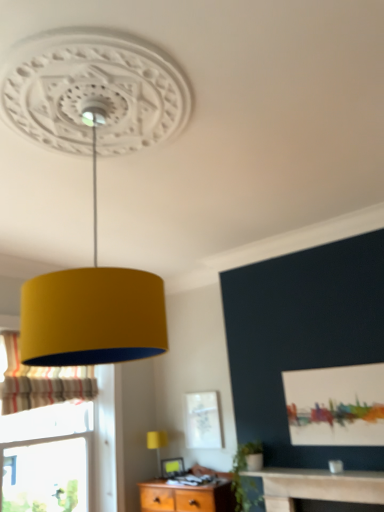
Question: From the image's perspective, would you say matte white picture frame at lower center is shown under striped fabric curtain at left?

Choices:
 (A) yes
 (B) no

Answer: (A)

Question: Can you confirm if matte white picture frame at lower center is smaller than striped fabric curtain at left?

Choices:
 (A) yes
 (B) no

Answer: (A)

Question: Is matte white picture frame at lower center not within striped fabric curtain at left?

Choices:
 (A) no
 (B) yes

Answer: (B)

Question: Is matte white picture frame at lower center at the left side of striped fabric curtain at left?

Choices:
 (A) no
 (B) yes

Answer: (A)

Question: From the image's perspective, is matte white picture frame at lower center on striped fabric curtain at left?

Choices:
 (A) no
 (B) yes

Answer: (A)

Question: Considering the relative sizes of matte white picture frame at lower center and striped fabric curtain at left in the image provided, is matte white picture frame at lower center shorter than striped fabric curtain at left?

Choices:
 (A) no
 (B) yes

Answer: (B)

Question: Is matte white picture frame at lower center at the right side of matte yellow lampshade at lower center?

Choices:
 (A) yes
 (B) no

Answer: (A)

Question: From the image's perspective, does matte white picture frame at lower center appear higher than matte yellow lampshade at lower center?

Choices:
 (A) yes
 (B) no

Answer: (B)

Question: Is matte white picture frame at lower center shorter than matte yellow lampshade at lower center?

Choices:
 (A) no
 (B) yes

Answer: (B)

Question: From a real-world perspective, is matte white picture frame at lower center beneath matte yellow lampshade at lower center?

Choices:
 (A) yes
 (B) no

Answer: (A)

Question: From the image's perspective, would you say matte white picture frame at lower center is shown under matte yellow lampshade at lower center?

Choices:
 (A) no
 (B) yes

Answer: (B)

Question: Considering the relative sizes of matte white picture frame at lower center and matte yellow lampshade at lower center in the image provided, is matte white picture frame at lower center taller than matte yellow lampshade at lower center?

Choices:
 (A) no
 (B) yes

Answer: (A)

Question: Would you say matte white picture frame at lower center is part of matte yellow lampshade at lower center's contents?

Choices:
 (A) no
 (B) yes

Answer: (A)